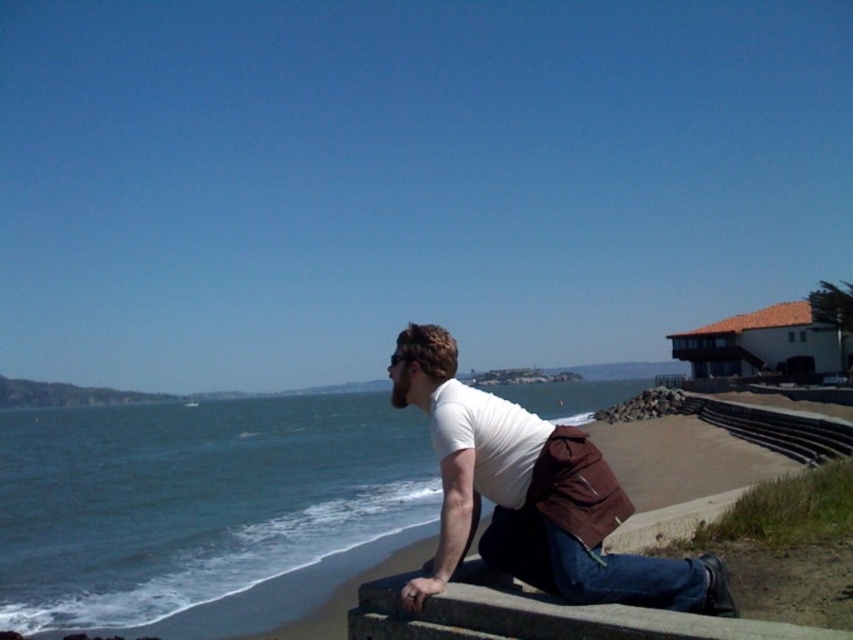
You are a photographer trying to capture the man in the scene. To ensure both the blue denim jeans at lower center and the blue water at lower left are in focus, which object should you focus on first?

The blue denim jeans at lower center is behind blue water at lower left, so you should focus on the blue denim jeans at lower center first to ensure both are in focus.

From the picture: You are standing at the center of the image and want to locate the blue water at lower left. Which direction should you turn to face it?

You should turn to your left to face the blue water at lower left since it is located at point (202, 509), which is to the lower left direction from the center.